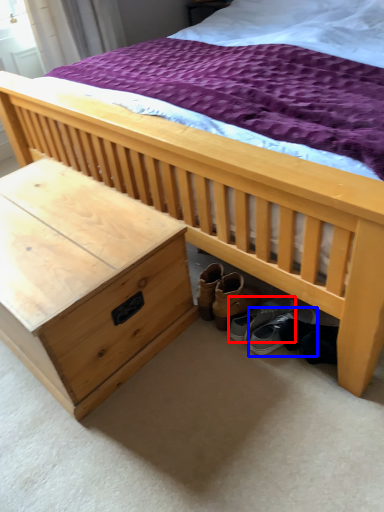
Question: Which of the following is the closest to the observer, footwear (highlighted by a red box) or footwear (highlighted by a blue box)?

Choices:
 (A) footwear
 (B) footwear

Answer: (B)